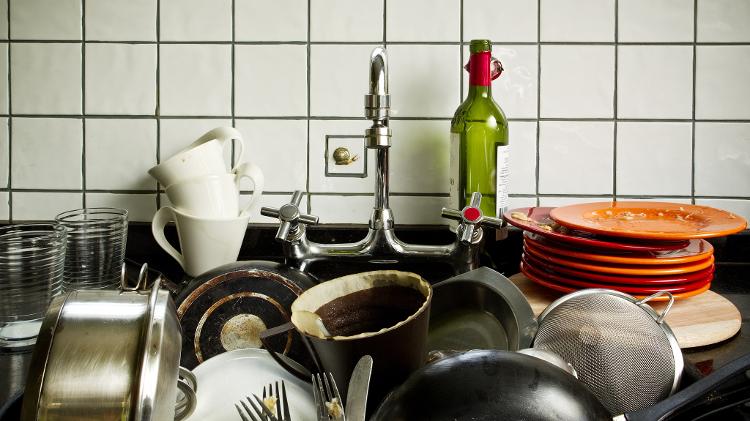
Locate an element on the screen. This screenshot has height=421, width=750. dirty dishes in sink is located at coordinates (686, 298), (684, 289), (684, 277), (686, 270), (699, 259), (663, 247), (690, 234), (252, 373).